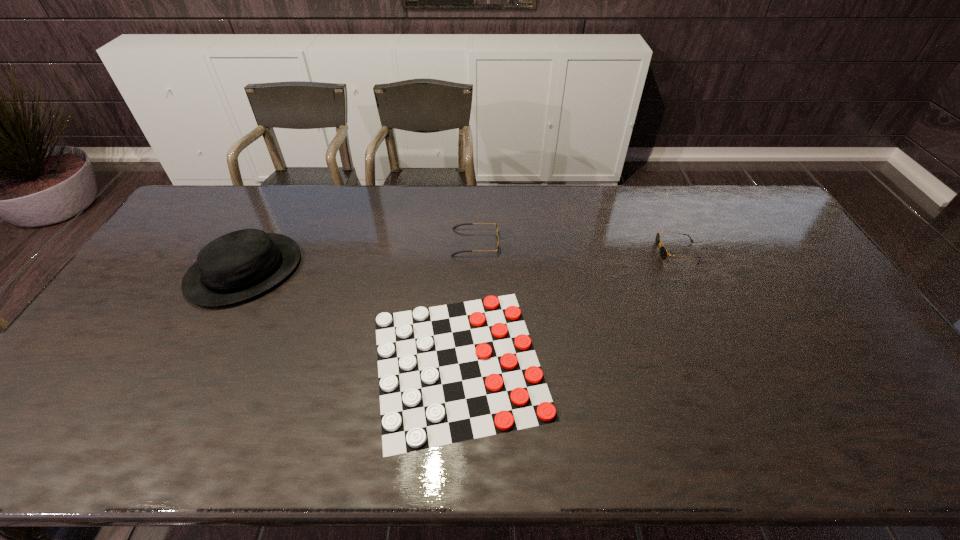
The image size is (960, 540). Identify the location of the tallest object. (240, 265).

Locate an element on the screen. the leftmost object is located at coordinates (240, 265).

Locate an element on the screen. This screenshot has width=960, height=540. the left sunglasses is located at coordinates (496, 224).

Find the location of a particular element. the right sunglasses is located at coordinates (663, 252).

Locate an element on the screen. The image size is (960, 540). the shortest object is located at coordinates (450, 373).

The image size is (960, 540). What are the coordinates of `blank area located 0.200m on the right of the tallest object` in the screenshot? It's located at (362, 271).

Locate an element on the screen. The image size is (960, 540). free spot located on the front-facing side of the left sunglasses is located at coordinates (x=564, y=243).

At what (x,y) coordinates should I click in order to perform the action: click on free region located on the lenses of the right sunglasses. Please return your answer as a coordinate pair (x, y). This screenshot has width=960, height=540. Looking at the image, I should click on (623, 252).

I want to click on vacant space located 0.070m on the lenses of the right sunglasses, so click(x=636, y=252).

The width and height of the screenshot is (960, 540). What are the coordinates of `vacant area located 0.050m on the lenses of the right sunglasses` in the screenshot? It's located at (641, 252).